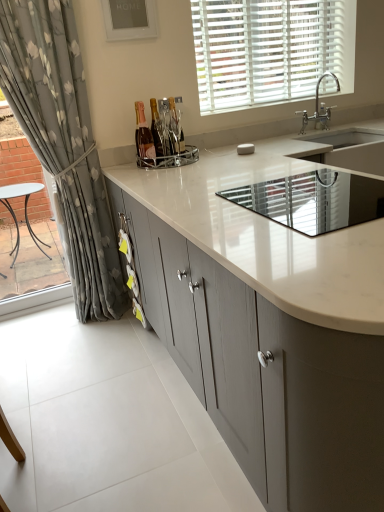
You are a GUI agent. You are given a task and a screenshot of the screen. Output one action in this format:
    pyautogui.click(x=<x>, y=<y>)
    Task: Click on the vacant area situated to the left side of floral fabric curtain at left
    The height and width of the screenshot is (512, 384).
    Given the screenshot: What is the action you would take?
    point(39,328)